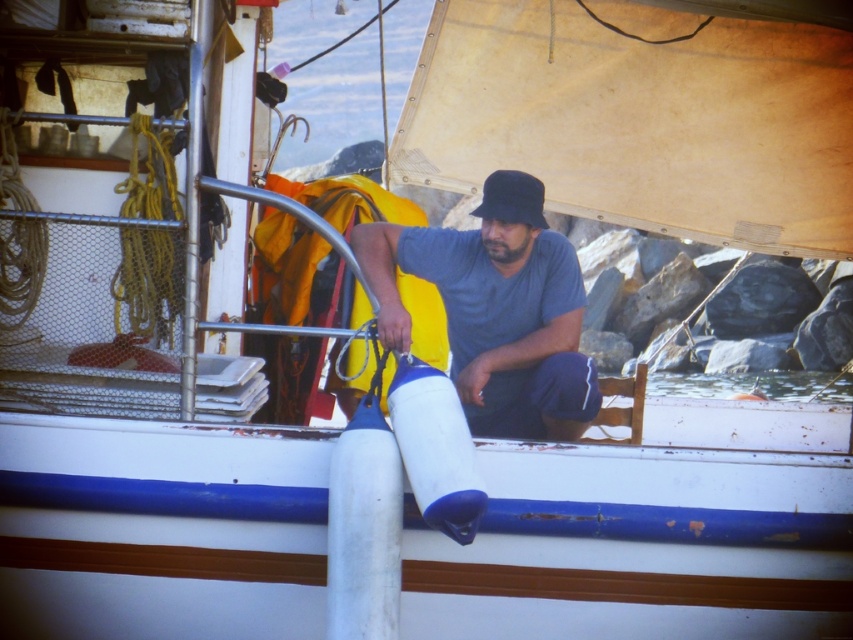
You are standing on the deck of the sailboat and need to place a small tool exactly at the midpoint between the clear water at lower center and the edge of the deck. What are the coordinates of that midpoint?

The coordinates of the midpoint between the clear water at lower center and the edge of the deck would be calculated by averaging the coordinates of the clear water at lower center and the edge. Since the clear water at lower center is at point (738, 384), the midpoint would be at (795, 384).

You are a photographer on the deck of a sailboat and need to capture a clear photo of the gray matte shirt at center and the black fabric baseball hat at center. Which object will appear larger in the photo?

The gray matte shirt at center will appear larger in the photo because it is much taller than the black fabric baseball hat at center.

You are a sailor on the deck of a sailboat and need to quickly identify clothing items. Which item is wider when viewed from above the deck? The gray matte shirt at center or the black fabric baseball hat at center?

The gray matte shirt at center is wider than the black fabric baseball hat at center.